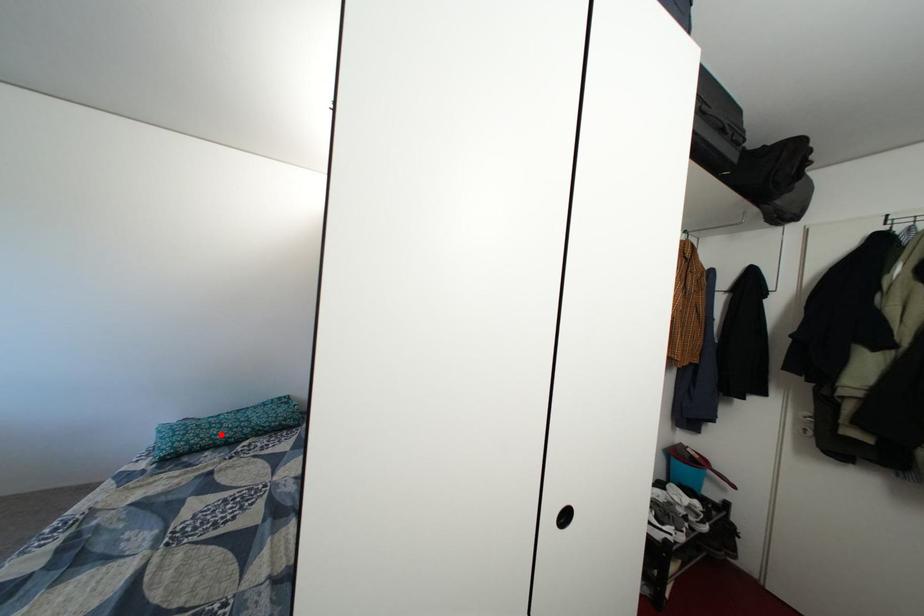
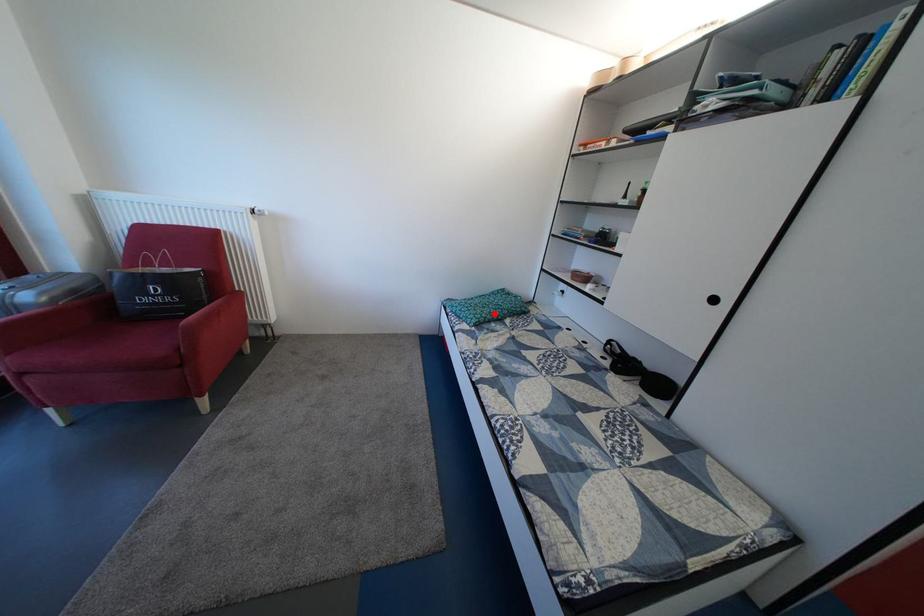
I am providing you with two images of the same scene from different viewpoints. A red point is marked on the first image and another point is marked on the second image. Is the red point in image1 aligned with the point shown in image2?

Yes